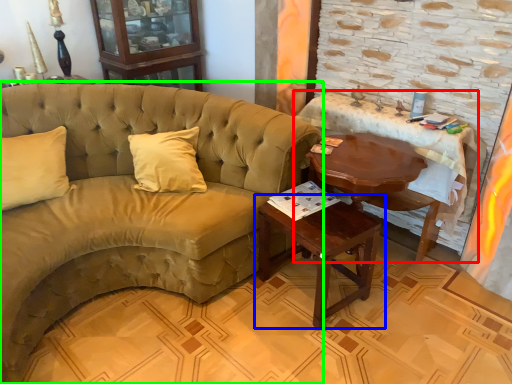
Question: Based on their relative distances, which object is farther from table (highlighted by a red box)? Choose from table (highlighted by a blue box) and studio couch (highlighted by a green box).

Choices:
 (A) table
 (B) studio couch

Answer: (B)